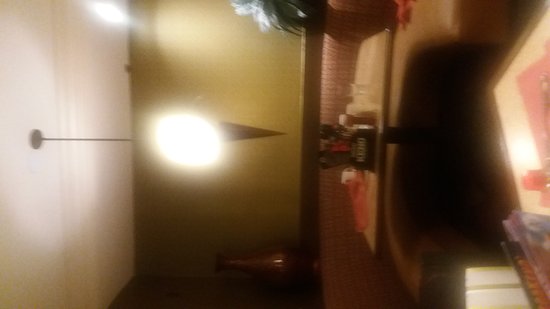
Locate an element on the screen. The height and width of the screenshot is (309, 550). wall is located at coordinates (246, 191), (195, 297).